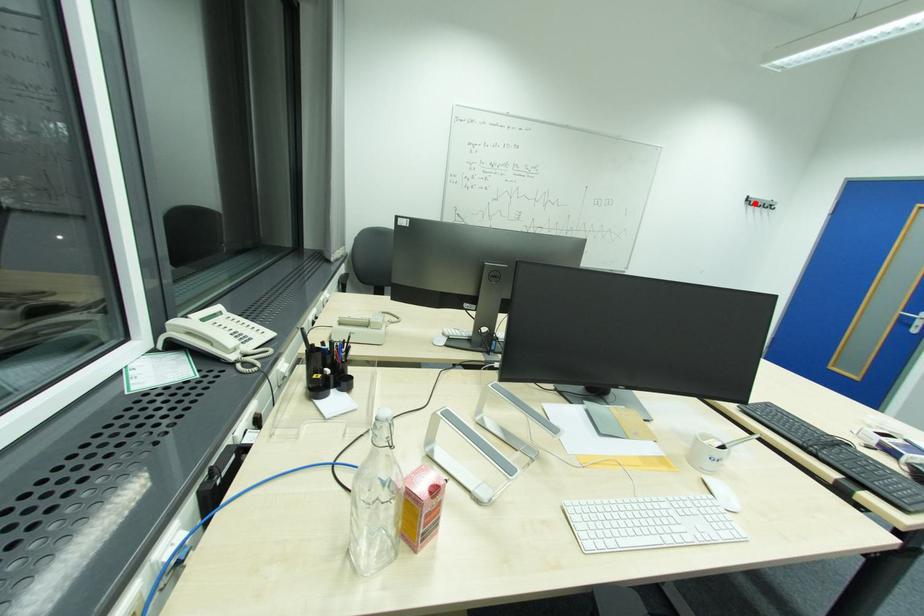
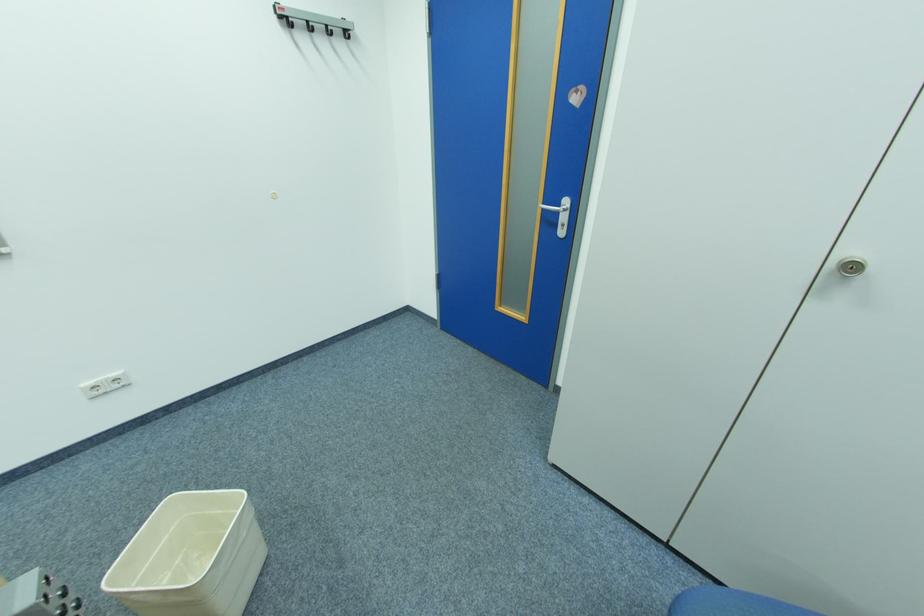
Find the pixel in the second image that matches the highlighted location in the first image.

(290, 25)